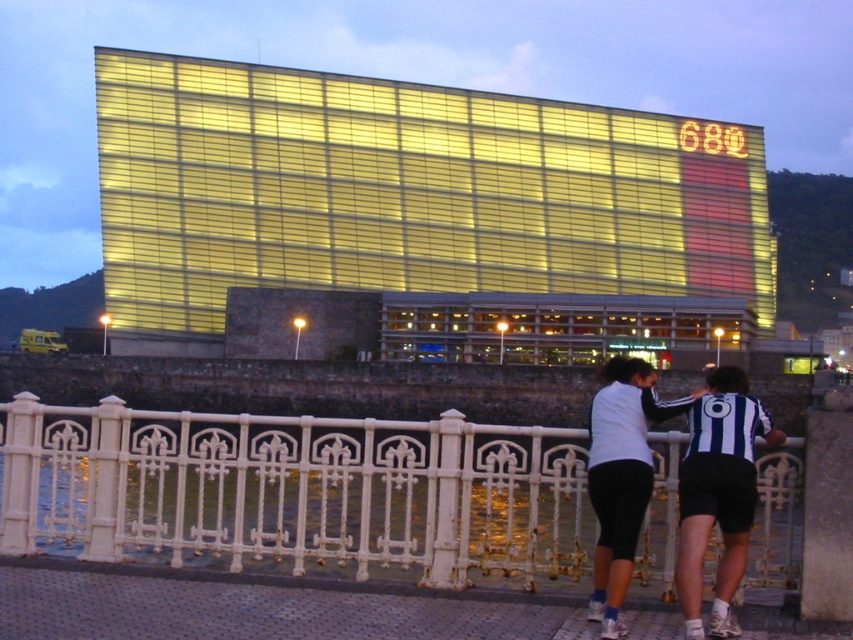
Question: Which of the following is the closest to the observer?

Choices:
 (A) striped jersey at center
 (B) white wrought iron fence at lower center

Answer: (A)

Question: Is white wrought iron fence at lower center positioned in front of striped jersey at center?

Choices:
 (A) yes
 (B) no

Answer: (B)

Question: Which of the following is the closest to the observer?

Choices:
 (A) striped jersey at center
 (B) white wrought iron fence at lower center

Answer: (A)

Question: Is white wrought iron fence at lower center positioned behind striped jersey at center?

Choices:
 (A) yes
 (B) no

Answer: (A)

Question: Does white wrought iron fence at lower center lie behind striped jersey at center?

Choices:
 (A) no
 (B) yes

Answer: (B)